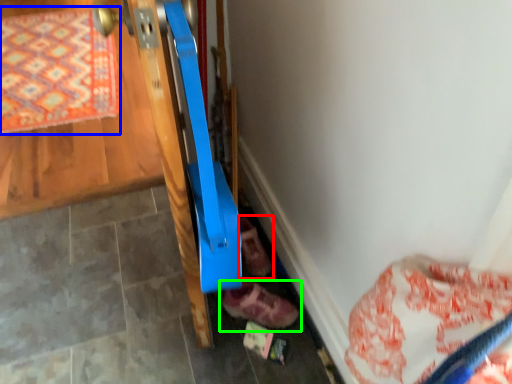
Question: Which object is positioned closest to footwear (highlighted by a red box)? Select from mat (highlighted by a blue box) and footwear (highlighted by a green box).

Choices:
 (A) mat
 (B) footwear

Answer: (B)